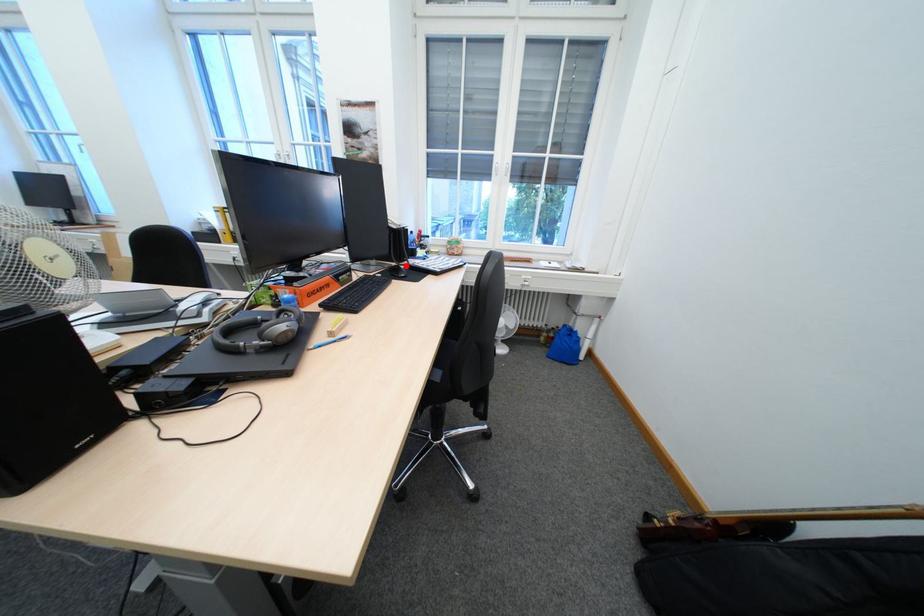
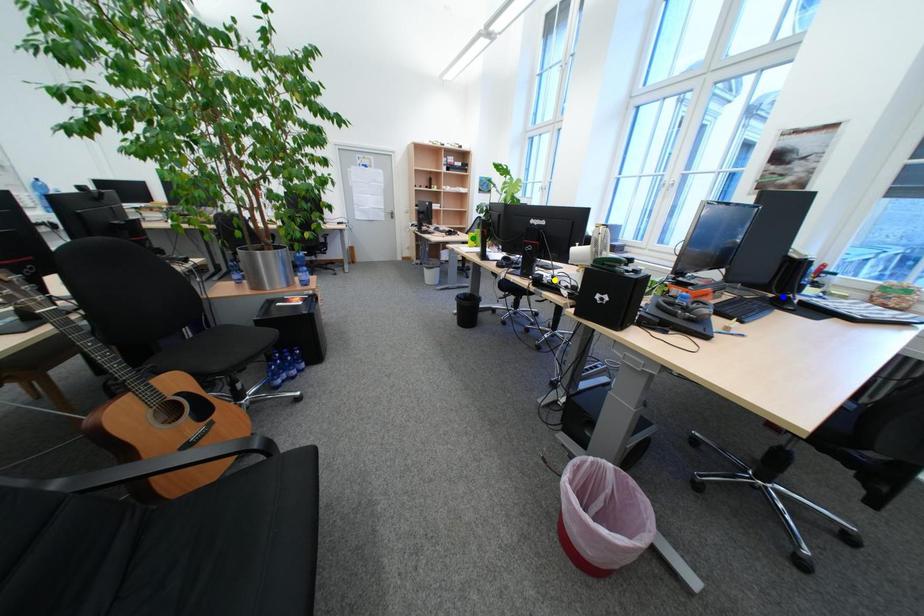
Question: I am providing you with two images of the same scene from different viewpoints. A red point is marked on the first image. You are given multiple points on the second image. Which point in image 2 represents the same 3d spot as the red point in image 1?

Choices:
 (A) green point
 (B) blue point
 (C) yellow point

Answer: (B)